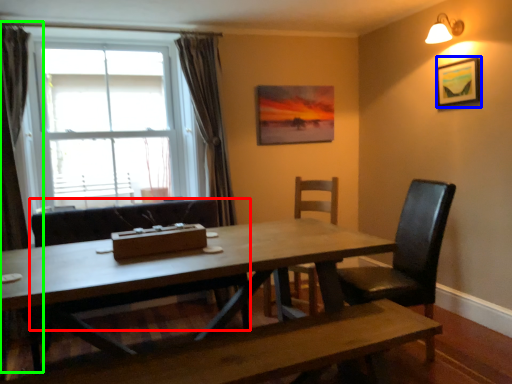
Question: Estimate the real-world distances between objects in this image. Which object is farther from chair (highlighted by a red box), picture frame (highlighted by a blue box) or curtain (highlighted by a green box)?

Choices:
 (A) picture frame
 (B) curtain

Answer: (A)